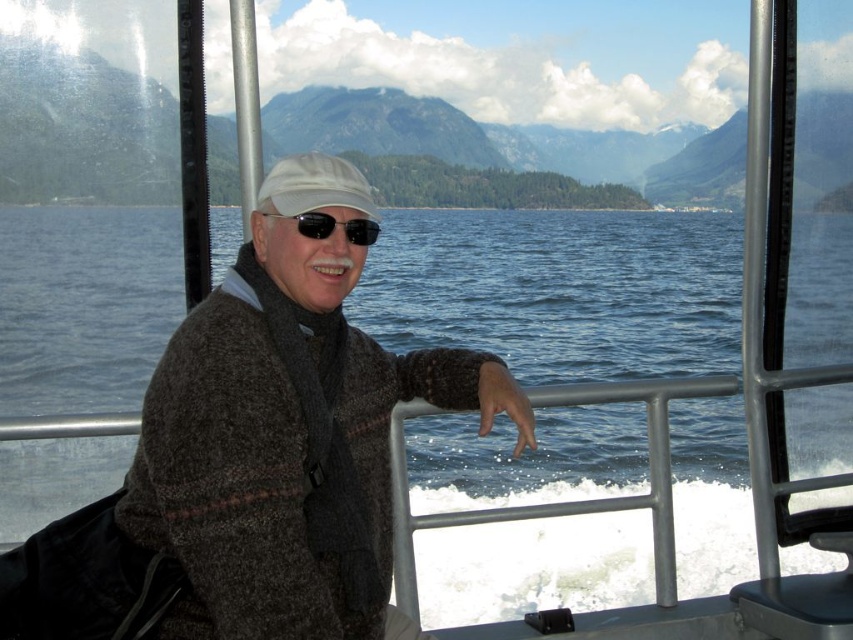
What do you see at coordinates (314, 186) in the screenshot? I see `white matte cap at center` at bounding box center [314, 186].

Between point (280, 160) and point (320, 237), which one is positioned behind?

Point (280, 160)

I want to click on white matte cap at center, so click(x=314, y=186).

Is knitted sweater at center to the right of black reflective sunglasses at center from the viewer's perspective?

Yes, knitted sweater at center is to the right of black reflective sunglasses at center.

Is point (367, 396) positioned behind point (363, 230)?

That is True.

You are a GUI agent. You are given a task and a screenshot of the screen. Output one action in this format:
    pyautogui.click(x=<x>, y=<y>)
    Task: Click on the knitted sweater at center
    The width and height of the screenshot is (853, 640).
    Given the screenshot: What is the action you would take?
    pyautogui.click(x=287, y=445)

Is point (212, 524) in front of point (276, 168)?

Yes, point (212, 524) is in front of point (276, 168).

Who is taller, knitted sweater at center or white matte cap at center?

knitted sweater at center is taller.

Image resolution: width=853 pixels, height=640 pixels. What do you see at coordinates (287, 445) in the screenshot? I see `knitted sweater at center` at bounding box center [287, 445].

This screenshot has height=640, width=853. I want to click on knitted sweater at center, so click(287, 445).